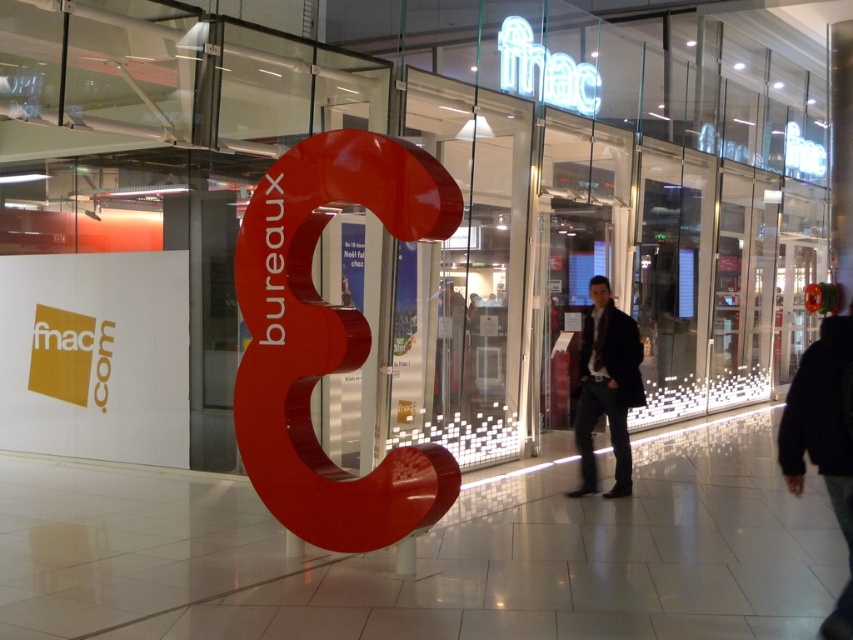
Question: In this image, where is black fabric jacket at lower right located relative to dark brown leather jacket at center?

Choices:
 (A) left
 (B) right

Answer: (B)

Question: Does black fabric jacket at lower right appear on the right side of dark brown leather jacket at center?

Choices:
 (A) no
 (B) yes

Answer: (B)

Question: Can you confirm if black fabric jacket at lower right is bigger than dark brown leather jacket at center?

Choices:
 (A) no
 (B) yes

Answer: (B)

Question: Which point is closer to the camera taking this photo?

Choices:
 (A) (822, 358)
 (B) (636, 340)

Answer: (A)

Question: Which point is closer to the camera?

Choices:
 (A) (810, 452)
 (B) (618, 355)

Answer: (A)